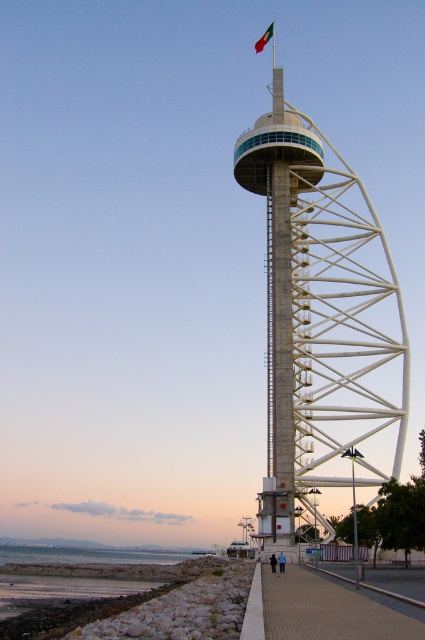
You are standing at the waterfront and see the white concrete tower at center and the green fabric flag at upper center. Which object is positioned to the left of the other?

The white concrete tower at center is to the right of the green fabric flag at upper center, so the green fabric flag at upper center is positioned to the left of the white concrete tower at center.

You are standing on the paved brick sidewalk at lower center and looking up at the green fabric flag at upper center. Which direction does the flag appear to be relative to your position?

The green fabric flag at upper center is to the left of the paved brick sidewalk at lower center, so from your position on the sidewalk, the flag appears to be on your left side.